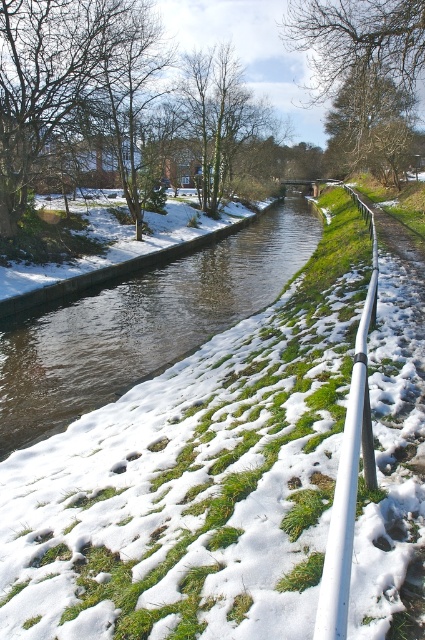
You are a photographer setting up a tripod to capture the canal and the tree. The tripod has a height limit of 1.5 meters. If the smooth concrete canal at center and the brown leafless tree at upper center are both in your frame, which one will you need to adjust your tripod height for to ensure it fits within the camera view?

The brown leafless tree at upper center is taller than the smooth concrete canal at center, so you need to adjust the tripod height to accommodate the tree to ensure it fits within the camera view.